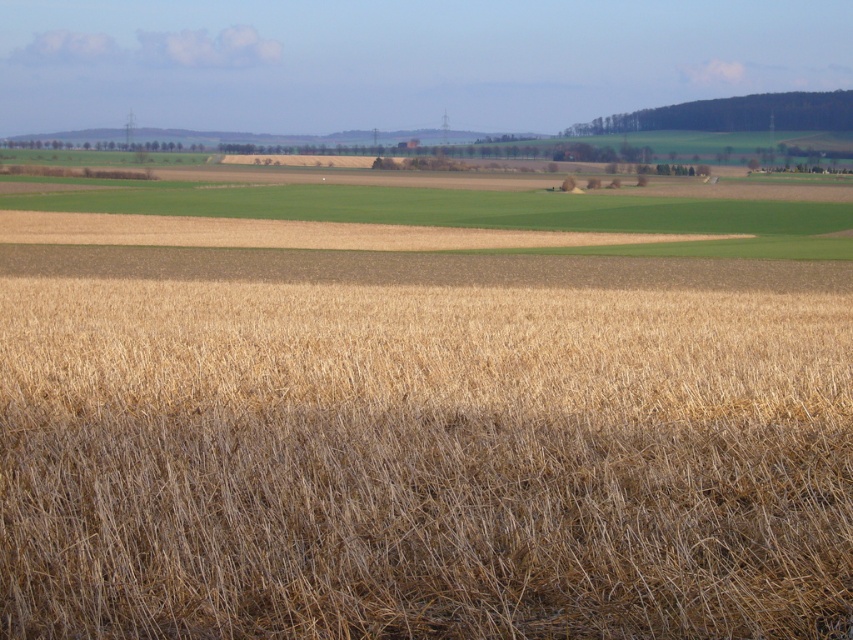
Based on the photo, you are a farmer checking the soil quality in your fields. You notice two areas at the center of your land labeled as dry straw field at center and brown grassland at center. Which area has a thicker layer of vegetation?

The brown grassland at center has a thicker layer of vegetation because the dry straw field at center is described as thinner than the brown grassland at center.

You are a farmer checking the fields. You notice the dry straw field at center and the brown grassland at center. Which one is positioned lower in the image?

The dry straw field at center is positioned below the brown grassland at center, so it is lower in the image.

Looking at this image, you are standing in the agricultural landscape and want to walk towards the distant mountains. Which object, the dry straw field at center or the brown grassland at center, would you pass over first?

The dry straw field at center is in front of the brown grassland at center, so you would pass over the dry straw field at center first before reaching the brown grassland at center.